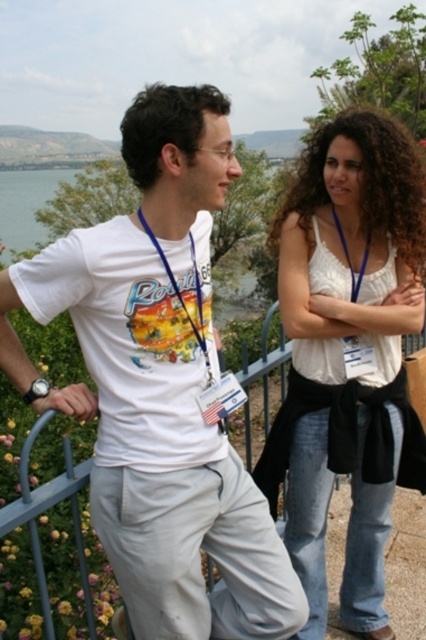
Question: Is white cotton tank top at right to the right of blue fabric lanyard at center from the viewer's perspective?

Choices:
 (A) yes
 (B) no

Answer: (A)

Question: Is blue fabric lanyard at center thinner than blue fabric lanyard at upper right?

Choices:
 (A) no
 (B) yes

Answer: (A)

Question: Does white cotton tank top at right appear over blue fabric lanyard at upper right?

Choices:
 (A) no
 (B) yes

Answer: (A)

Question: Which point appears farthest from the camera in this image?

Choices:
 (A) (345, 244)
 (B) (371, 179)
 (C) (199, 282)

Answer: (A)

Question: Which of these objects is positioned farthest from the blue fabric lanyard at center?

Choices:
 (A) white cotton tank top at right
 (B) blue fabric lanyard at upper right
 (C) white cotton t-shirt at left

Answer: (A)

Question: Estimate the real-world distances between objects in this image. Which object is farther from the white cotton tank top at right?

Choices:
 (A) blue fabric lanyard at upper right
 (B) blue fabric lanyard at center
 (C) white cotton t-shirt at left

Answer: (B)